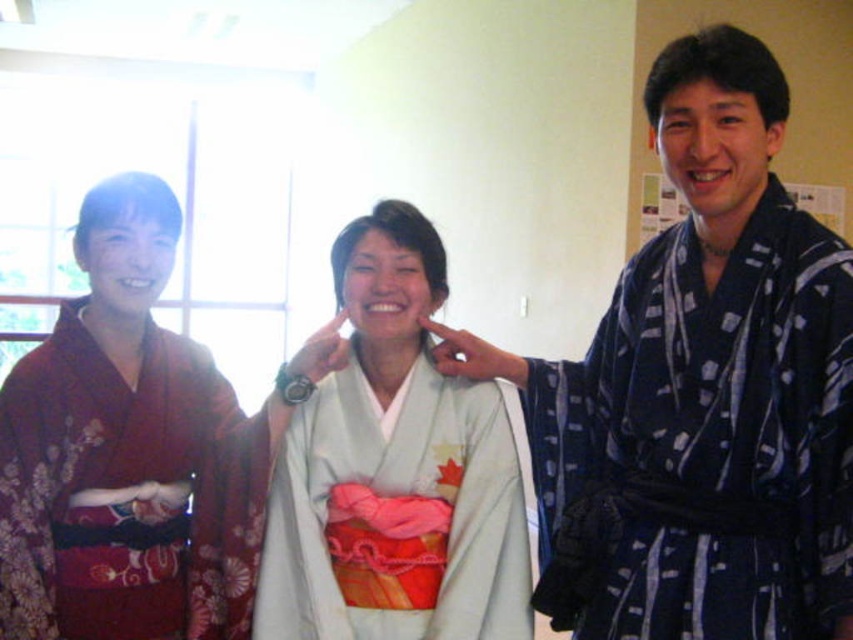
Question: Which object is positioned closest to the white silk kimono at center?

Choices:
 (A) matte red kimono at left
 (B) blue printed robe at right

Answer: (A)

Question: Which of the following is the closest to the observer?

Choices:
 (A) matte red kimono at left
 (B) blue printed robe at right
 (C) white silk kimono at center

Answer: (B)

Question: Does white silk kimono at center have a greater width compared to matte red kimono at left?

Choices:
 (A) yes
 (B) no

Answer: (A)

Question: Considering the relative positions of blue printed robe at right and matte red kimono at left in the image provided, where is blue printed robe at right located with respect to matte red kimono at left?

Choices:
 (A) above
 (B) below

Answer: (A)

Question: Which point is farther from the camera taking this photo?

Choices:
 (A) (165, 564)
 (B) (390, 280)

Answer: (A)

Question: Does white silk kimono at center have a lesser width compared to matte red kimono at left?

Choices:
 (A) yes
 (B) no

Answer: (B)